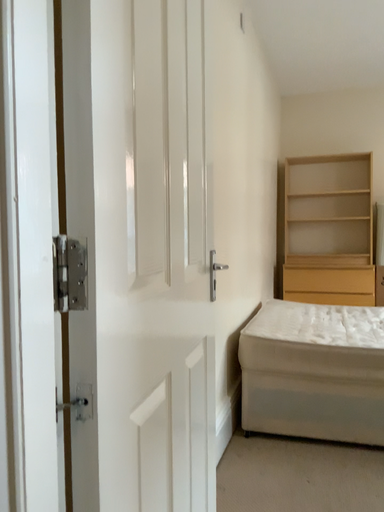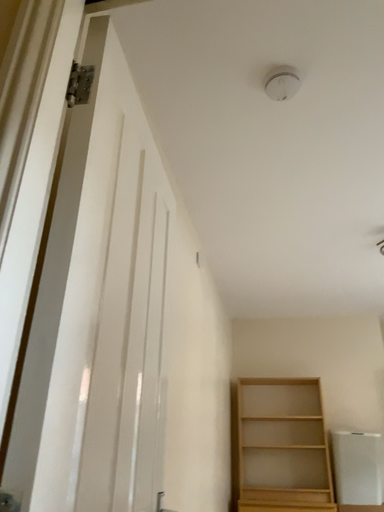
Question: Which way did the camera rotate in the video?

Choices:
 (A) rotated right
 (B) rotated left

Answer: (A)